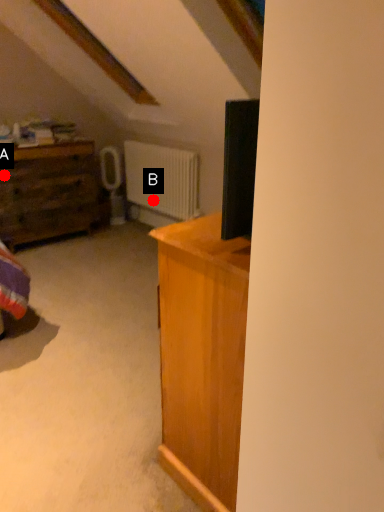
Question: Two points are circled on the image, labeled by A and B beside each circle. Which of the following is the closest to the observer?

Choices:
 (A) A is closer
 (B) B is closer

Answer: (A)